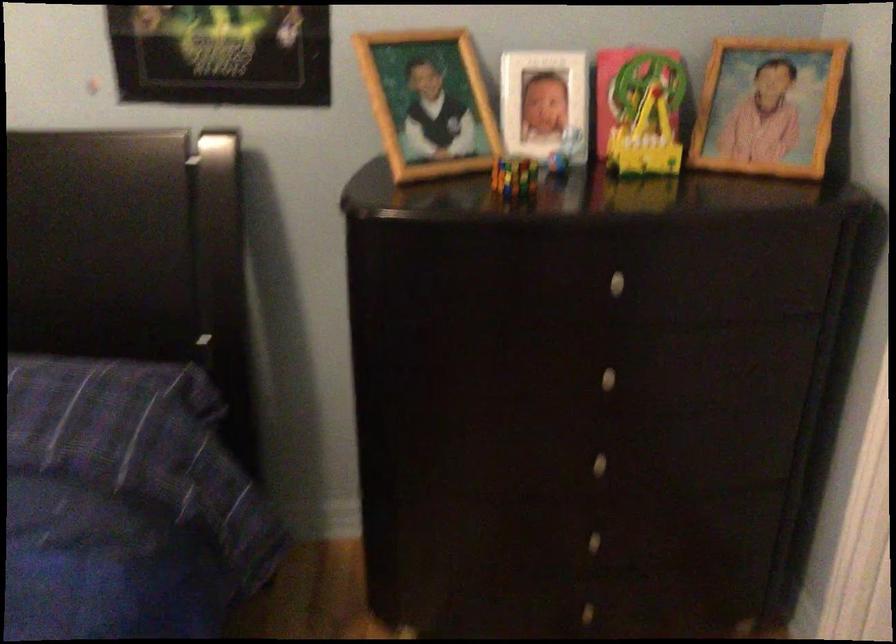
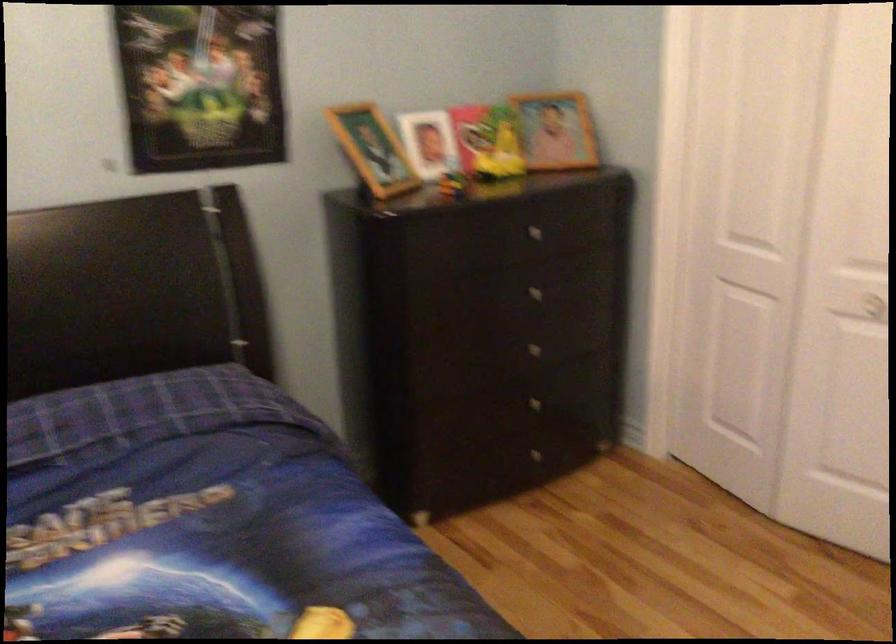
Locate, in the second image, the point that corresponds to (609,281) in the first image.

(530, 230)